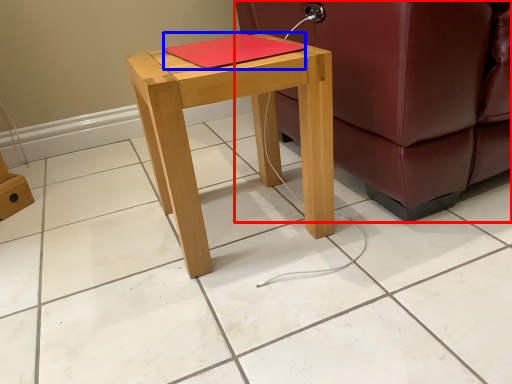
Question: Which point is closer to the camera, studio couch (highlighted by a red box) or notebook (highlighted by a blue box)?

Choices:
 (A) studio couch
 (B) notebook

Answer: (A)